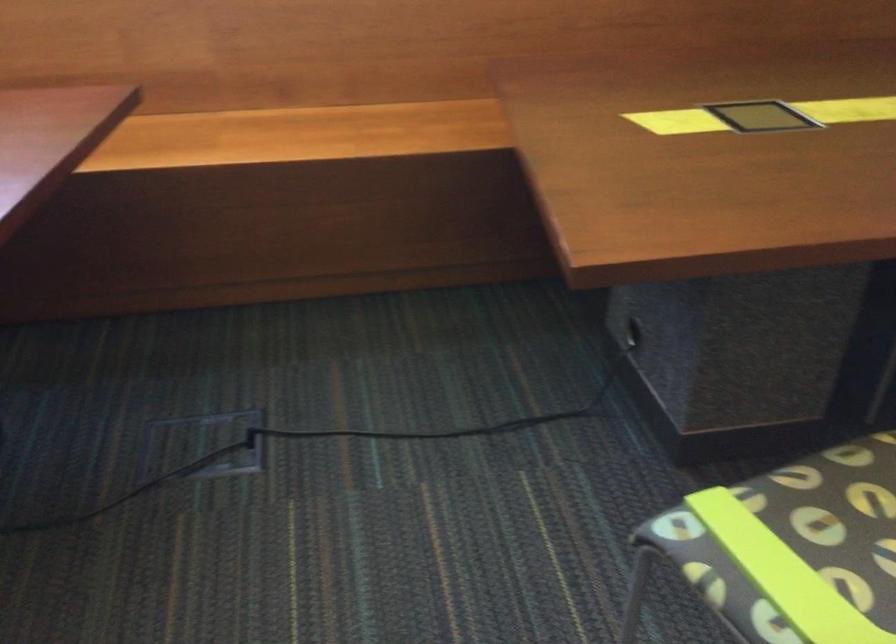
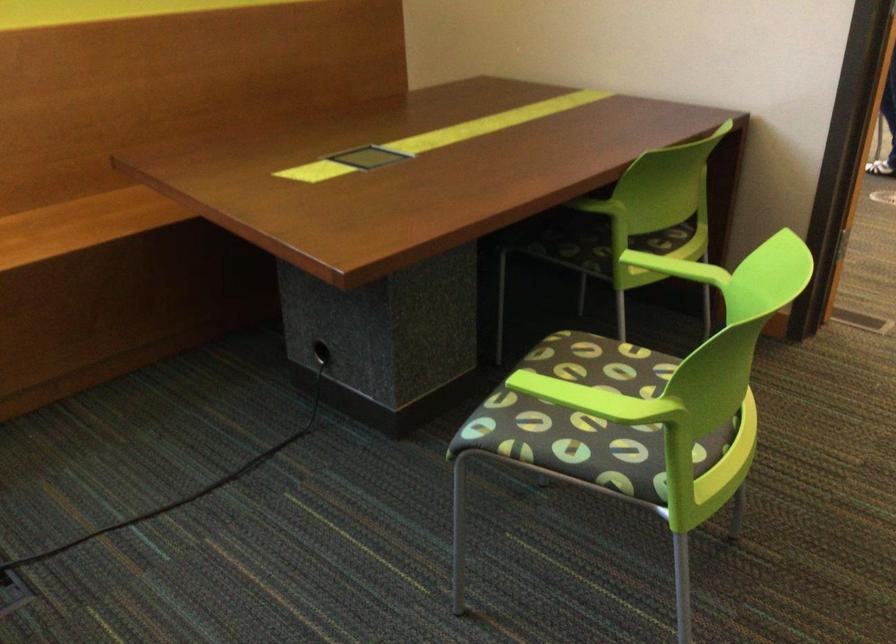
In the second image, find the point that corresponds to the point at 453,128 in the first image.

(80, 223)